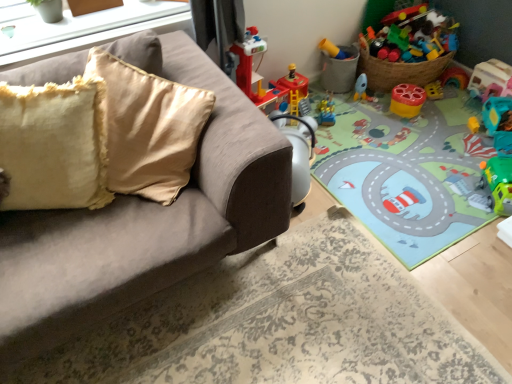
At what (x,y) coordinates should I click in order to perform the action: click on free area behind translucent plastic toy at center, which is the sixth toy in right-to-left order. Please return your answer as a coordinate pair (x, y). Looking at the image, I should click on (329, 96).